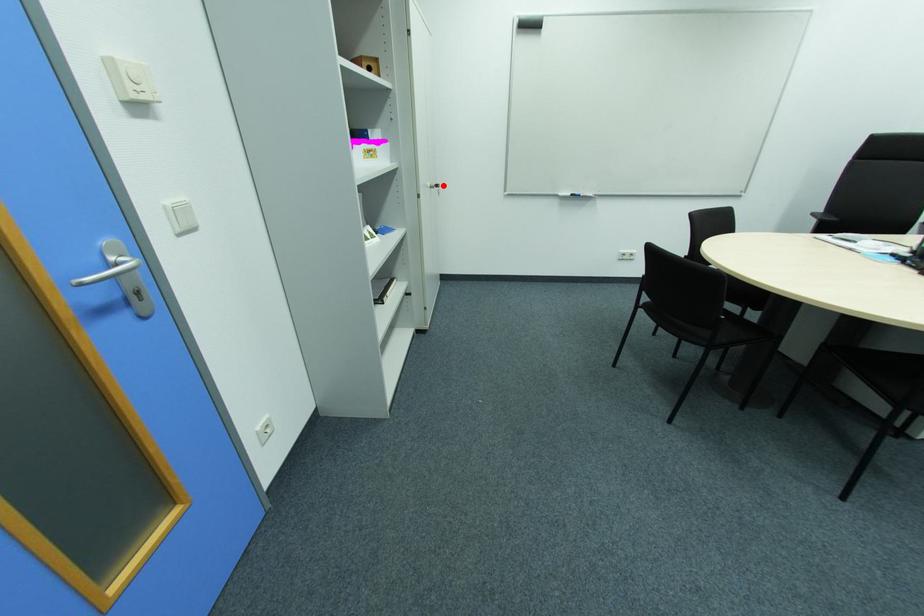
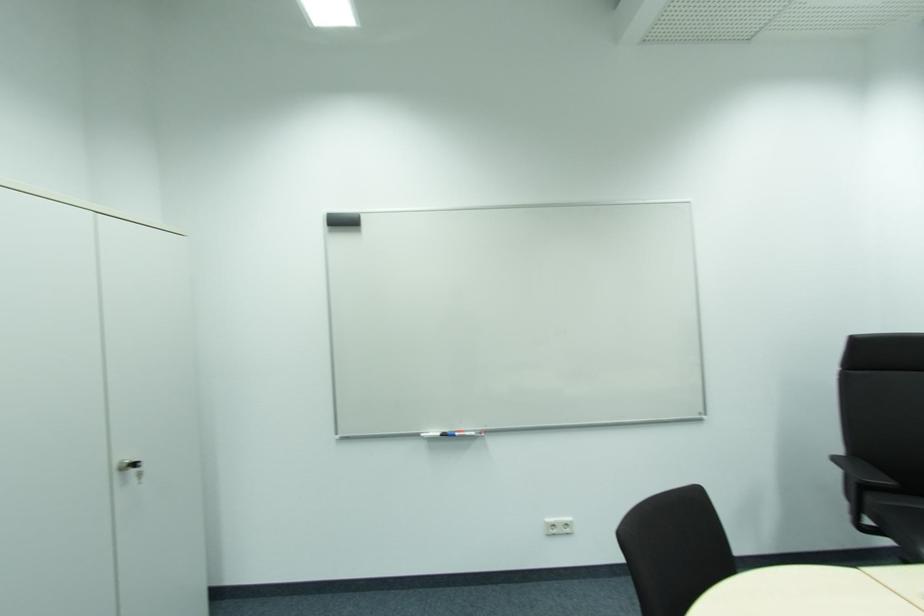
Where in the second image is the point corresponding to the highlighted location from the first image?

(140, 464)